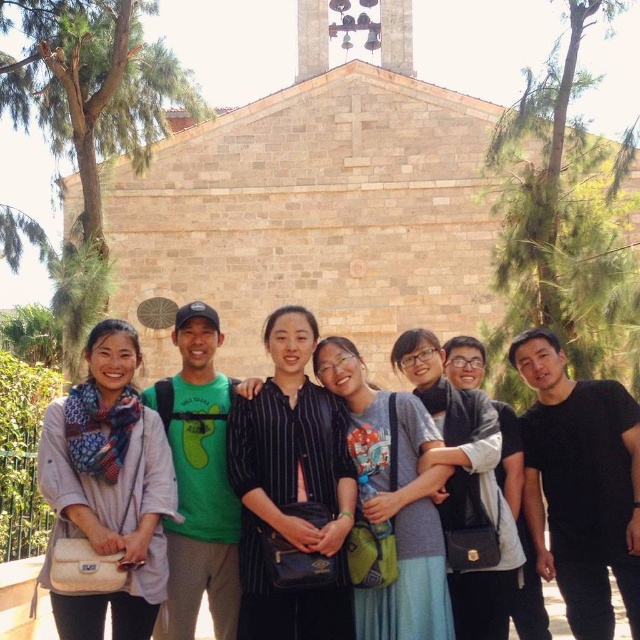
Question: Is matte scarf at left thinner than striped shirt at center?

Choices:
 (A) no
 (B) yes

Answer: (A)

Question: Does matte scarf at left lie in front of striped fabric shirt at center?

Choices:
 (A) yes
 (B) no

Answer: (B)

Question: Which point is farther to the camera?

Choices:
 (A) (492, 481)
 (B) (314, 432)

Answer: (A)

Question: Can you confirm if matte scarf at left is bigger than striped shirt at center?

Choices:
 (A) yes
 (B) no

Answer: (B)

Question: Which point is closer to the camera?

Choices:
 (A) matte scarf at left
 (B) striped shirt at center
 (C) striped fabric shirt at center

Answer: (C)

Question: Which of the following is the farthest from the observer?

Choices:
 (A) (470, 547)
 (B) (65, 605)
 (C) (246, 512)

Answer: (C)